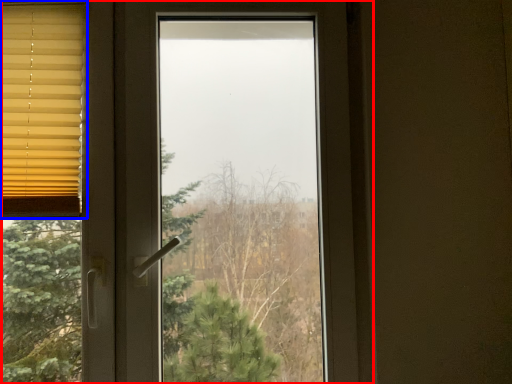
Question: Which object is closer to the camera taking this photo, window (highlighted by a red box) or window blind (highlighted by a blue box)?

Choices:
 (A) window
 (B) window blind

Answer: (A)